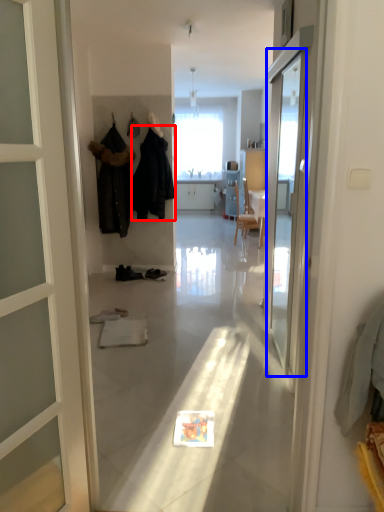
Question: Which of the following is the closest to the observer, clothing (highlighted by a red box) or screen door (highlighted by a blue box)?

Choices:
 (A) clothing
 (B) screen door

Answer: (B)